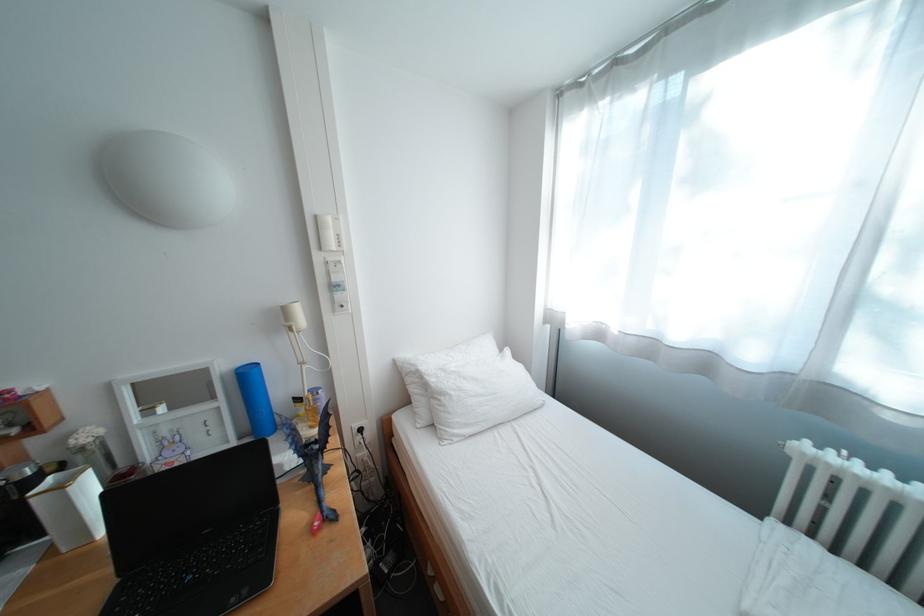
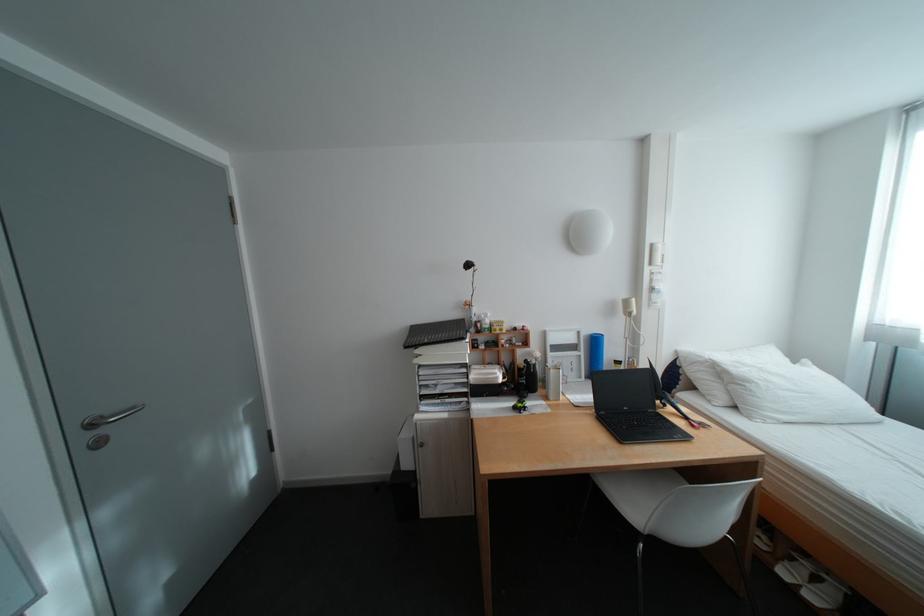
Find the pixel in the second image that matches [456,397] in the first image.

(761, 384)